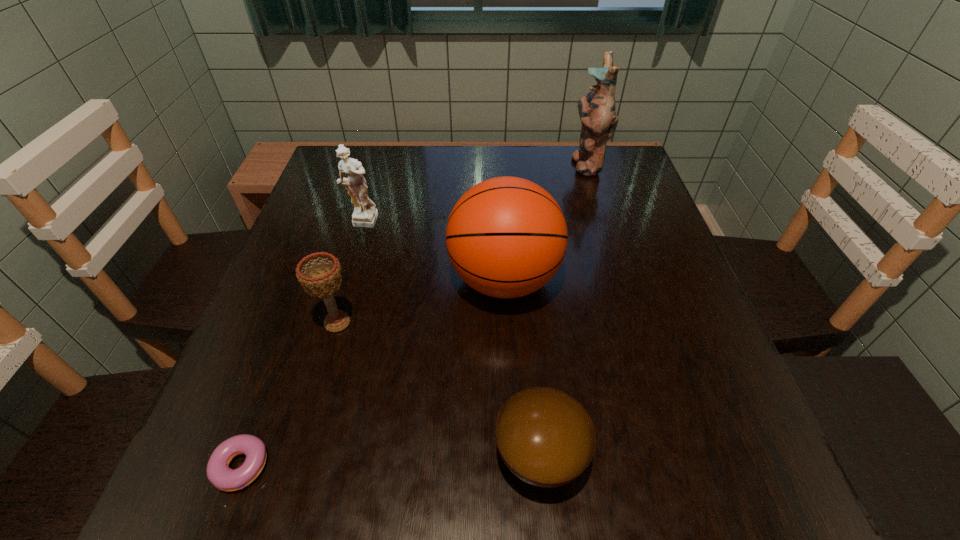
The width and height of the screenshot is (960, 540). Identify the location of free spot between the shorter figurine and the bowl. (450, 339).

The width and height of the screenshot is (960, 540). I want to click on vacant area between the rightmost object and the fifth tallest object, so click(x=563, y=309).

Where is `free space between the second shortest object and the left figurine`? The height and width of the screenshot is (540, 960). free space between the second shortest object and the left figurine is located at coordinates (450, 339).

Identify the location of free spot between the bowl and the second farthest object. (450, 339).

I want to click on free space between the doughnut and the farthest object, so click(x=413, y=319).

Image resolution: width=960 pixels, height=540 pixels. Identify the location of free space between the basketball and the doughnut. (372, 376).

Identify which object is the third closest to the nearer figurine. Please provide its 2D coordinates. Your answer should be formatted as a tuple, i.e. [(x, y)], where the tuple contains the x and y coordinates of a point satisfying the conditions above.

[(219, 474)]

Identify which object is located as the fourth nearest to the second farthest object. Please provide its 2D coordinates. Your answer should be formatted as a tuple, i.e. [(x, y)], where the tuple contains the x and y coordinates of a point satisfying the conditions above.

[(597, 110)]

Find the location of a particular element. The image size is (960, 540). free space that satisfies the following two spatial constraints: 1. on the front-facing side of the fifth nearest object; 2. on the left side of the second shortest object is located at coordinates point(293,455).

Find the location of a particular element. Image resolution: width=960 pixels, height=540 pixels. free space that satisfies the following two spatial constraints: 1. on the front-facing side of the shorter figurine; 2. on the right side of the basketball is located at coordinates (345, 280).